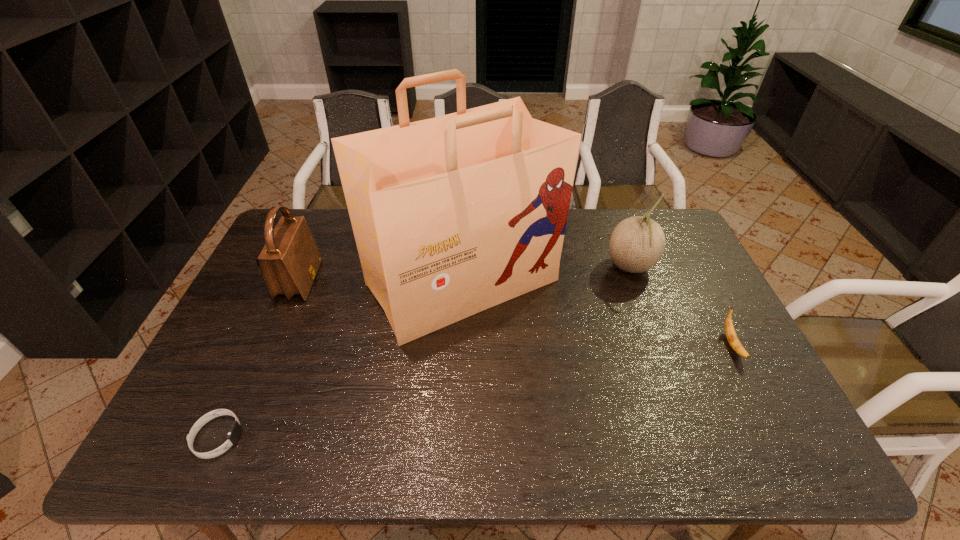
Identify the location of free space between the second shortest object and the shoulder bag. (516, 313).

Locate an element on the screen. The image size is (960, 540). free area in between the shortest object and the third object from right to left is located at coordinates (340, 360).

This screenshot has width=960, height=540. I want to click on vacant space in between the cantaloup and the nearest object, so click(424, 352).

Where is `free space between the second object from right to left and the nearest object`? This screenshot has width=960, height=540. free space between the second object from right to left and the nearest object is located at coordinates (424, 352).

Locate which object ranks fourth in proximity to the nearest object. Please provide its 2D coordinates. Your answer should be formatted as a tuple, i.e. [(x, y)], where the tuple contains the x and y coordinates of a point satisfying the conditions above.

[(731, 335)]

Identify which object is located as the second nearest to the third object from left to right. Please provide its 2D coordinates. Your answer should be formatted as a tuple, i.e. [(x, y)], where the tuple contains the x and y coordinates of a point satisfying the conditions above.

[(637, 243)]